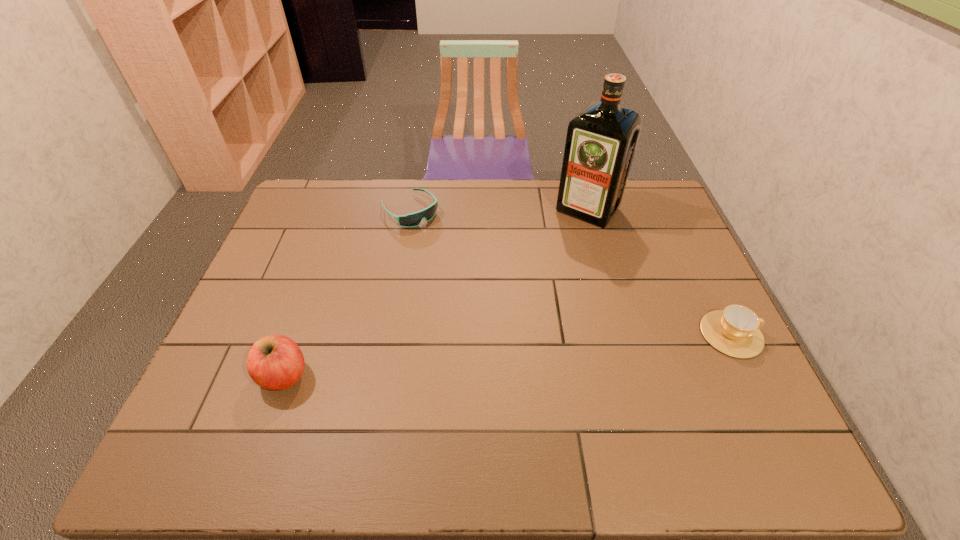
The height and width of the screenshot is (540, 960). Find the location of `unoccupied area between the tallest object and the rightmost object`. unoccupied area between the tallest object and the rightmost object is located at coordinates (660, 272).

In order to click on free space between the third shortest object and the third object from right to left in this screenshot , I will do `click(348, 293)`.

Where is `free space between the shortest object and the apple`? Image resolution: width=960 pixels, height=540 pixels. free space between the shortest object and the apple is located at coordinates (348, 293).

Identify the location of free point between the second tallest object and the liquor. Image resolution: width=960 pixels, height=540 pixels. (436, 293).

Where is `vacant region between the leftmost object and the rightmost object`? Image resolution: width=960 pixels, height=540 pixels. vacant region between the leftmost object and the rightmost object is located at coordinates (508, 355).

Where is `free space that is in between the second tallest object and the liquor`? free space that is in between the second tallest object and the liquor is located at coordinates (436, 293).

The height and width of the screenshot is (540, 960). Find the location of `object that can be found as the third closest to the cup`. object that can be found as the third closest to the cup is located at coordinates (275, 362).

I want to click on the second closest object to the rightmost object, so click(414, 219).

This screenshot has height=540, width=960. Identify the location of vacant space that satisfies the following two spatial constraints: 1. on the front side of the cup; 2. with the handle on the side of the second object from left to right. (388, 334).

What are the coordinates of `free space in the image that satisfies the following two spatial constraints: 1. on the front side of the cup; 2. with the handle on the side of the sunglasses` in the screenshot? It's located at (388, 334).